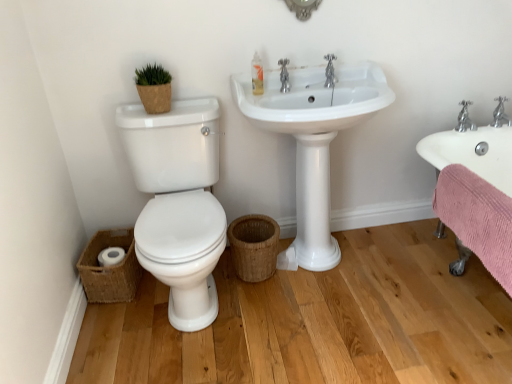
Question: From the image's perspective, is white glossy sink at center, placed as the second sink when sorted from right to left, positioned above or below woven brown basket at lower left, arranged as the 1th basket when viewed from the left?

Choices:
 (A) above
 (B) below

Answer: (A)

Question: Is white glossy sink at center, placed as the second sink when sorted from right to left, in front of or behind woven brown basket at lower left, which is counted as the 2th basket, starting from the right, in the image?

Choices:
 (A) behind
 (B) front

Answer: (B)

Question: Which of these objects is positioned farthest from the woven brown basket at lower center, the 1th basket when ordered from right to left?

Choices:
 (A) pink textured towel at right, the first sink in the right-to-left sequence
 (B) chrome metallic faucet at upper center, placed as the 2th tap when sorted from right to left
 (C) white glossy sink at center, the first sink positioned from the left
 (D) woven brown basket at lower left, arranged as the 1th basket when viewed from the left
 (E) chrome metallic faucet at upper right, which ranks as the second tap in top-to-bottom order

Answer: (E)

Question: Estimate the real-world distances between objects in this image. Which object is closer to the white glossy toilet at left?

Choices:
 (A) white glossy sink at center, the first sink positioned from the left
 (B) chrome metallic faucet at upper center, marked as the 1th tap in a left-to-right arrangement
 (C) chrome metallic faucet at upper right, the 1th tap from the right
 (D) pink textured towel at right, which is the second sink in left-to-right order
 (E) translucent plastic soap dispenser at upper center

Answer: (A)